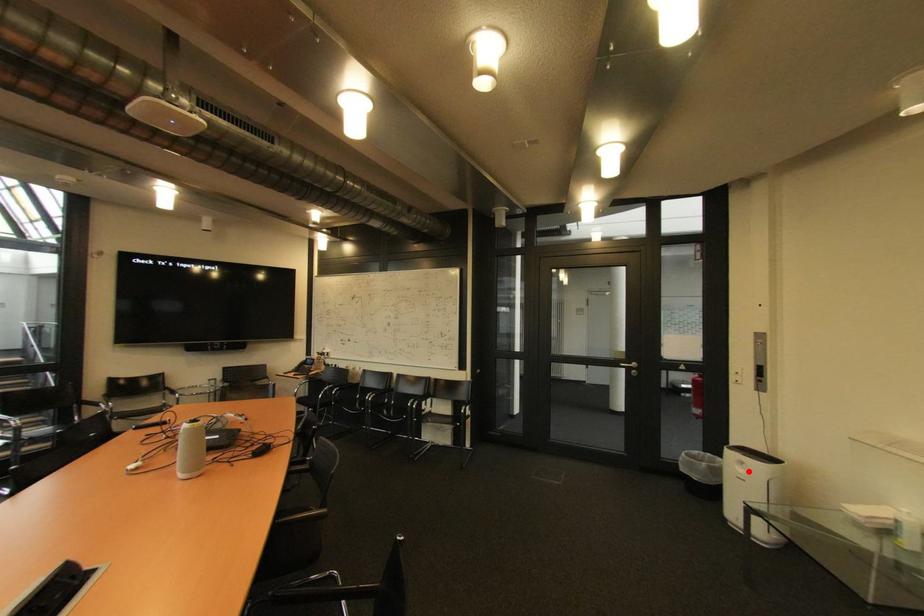
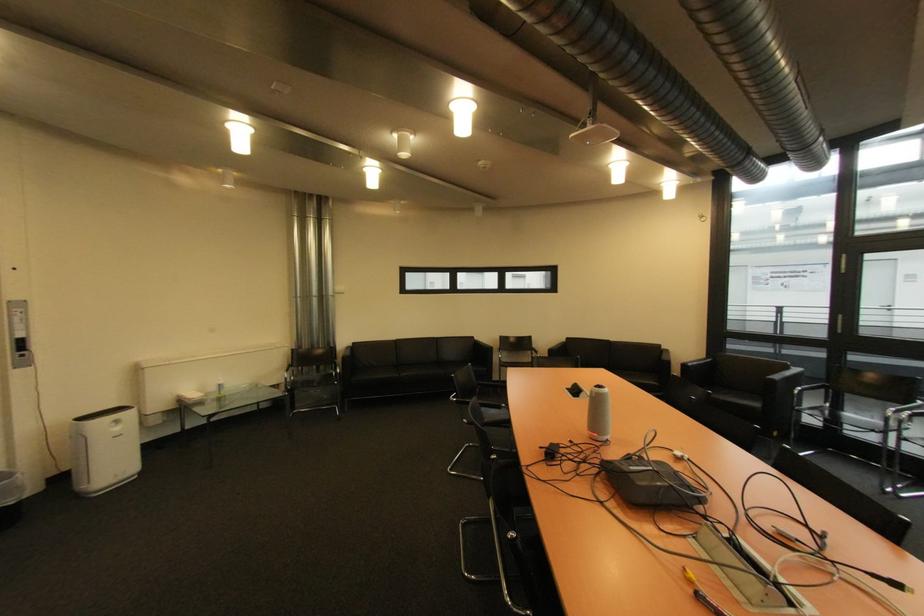
In the second image, find the point that corresponds to the highlighted location in the first image.

(124, 430)